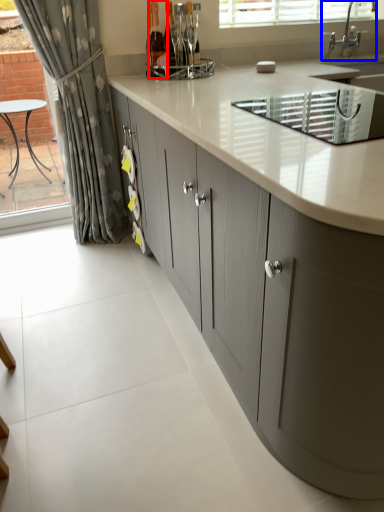
Question: Which object is closer to the camera taking this photo, bottle (highlighted by a red box) or tap (highlighted by a blue box)?

Choices:
 (A) bottle
 (B) tap

Answer: (A)